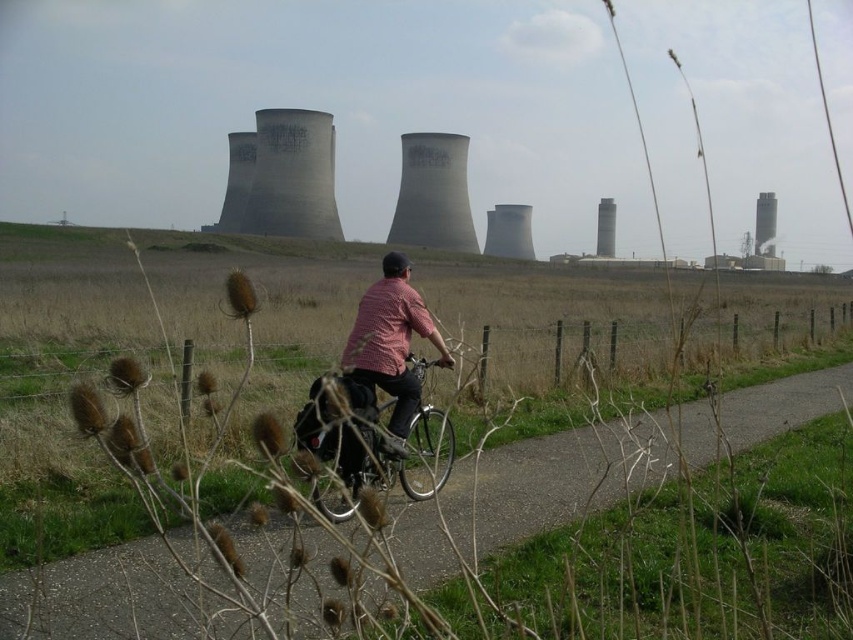
You are a drone operator trying to capture a photo of the smooth asphalt path at center and the checkered fabric shirt at center. Which object should you focus on first to ensure both are in the same frame?

The smooth asphalt path at center is closer to the viewer than the checkered fabric shirt at center, so you should focus on the smooth asphalt path at center first to ensure both are in the same frame.

You are a delivery person who needs to carry a package that is 1 meter wide. You see the shiny metallic bicycle at center and the checkered fabric shirt at center in the image. Can the package fit between the two objects?

The shiny metallic bicycle at center might be wider than checkered fabric shirt at center. Since the package is 1 meter wide, it depends on the actual width between them. However, since the bicycle might be wider, there might not be enough space. It is uncertain without exact measurements.

You are a cyclist planning to ride along the smooth asphalt path at center. You notice the smooth gray tower at upper right in the distance. Which object takes up more space in the image?

The smooth gray tower at upper right takes up more space in the image than the smooth asphalt path at center, as the path occupies less space according to the description.